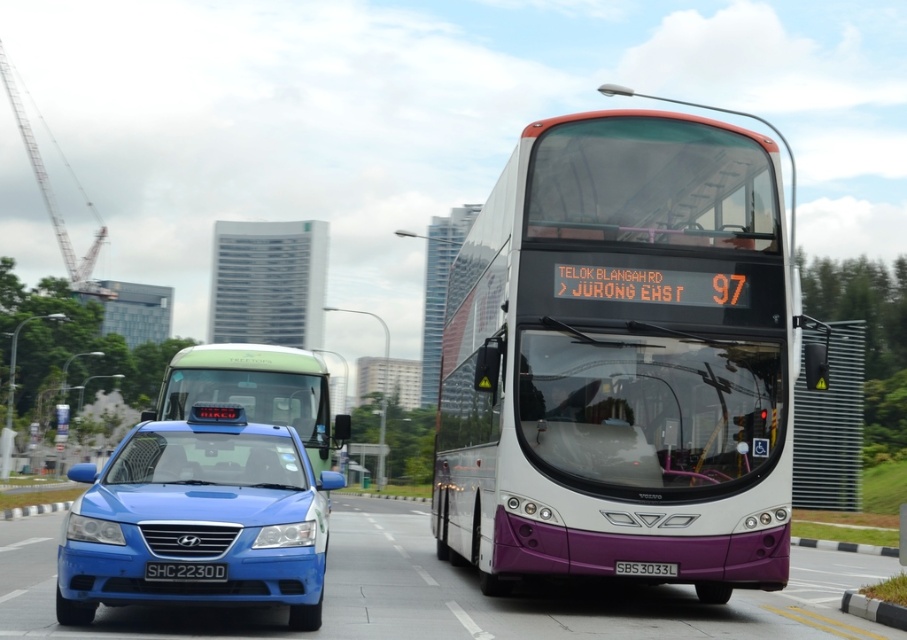
Which is more to the left, metallic gray crane at left or white plastic license plate at center?

metallic gray crane at left

Can you confirm if metallic gray crane at left is positioned below white plastic license plate at center?

No, metallic gray crane at left is not below white plastic license plate at center.

At what (x,y) coordinates should I click in order to perform the action: click on metallic gray crane at left. Please return your answer as a coordinate pair (x, y). The height and width of the screenshot is (640, 907). Looking at the image, I should click on (54, 198).

This screenshot has height=640, width=907. Find the location of `metallic gray crane at left`. metallic gray crane at left is located at coordinates (54, 198).

Does blue glossy taxi at center appear on the left side of metallic gray crane at left?

Incorrect, blue glossy taxi at center is not on the left side of metallic gray crane at left.

Measure the distance from blue glossy taxi at center to metallic gray crane at left.

The distance of blue glossy taxi at center from metallic gray crane at left is 331.66 feet.

Between point (200, 444) and point (79, 292), which one is positioned in front?

Point (200, 444) is in front.

The image size is (907, 640). In order to click on blue glossy taxi at center in this screenshot , I will do `click(198, 518)`.

Between blue glossy car at lower left and black plastic license plate at center, which one has less height?

With less height is black plastic license plate at center.

Which is more to the right, blue glossy car at lower left or black plastic license plate at center?

Positioned to the right is blue glossy car at lower left.

Image resolution: width=907 pixels, height=640 pixels. Find the location of `blue glossy car at lower left`. blue glossy car at lower left is located at coordinates (447, 595).

You are a GUI agent. You are given a task and a screenshot of the screen. Output one action in this format:
    pyautogui.click(x=<x>, y=<y>)
    Task: Click on the blue glossy car at lower left
    The width and height of the screenshot is (907, 640).
    Given the screenshot: What is the action you would take?
    pyautogui.click(x=447, y=595)